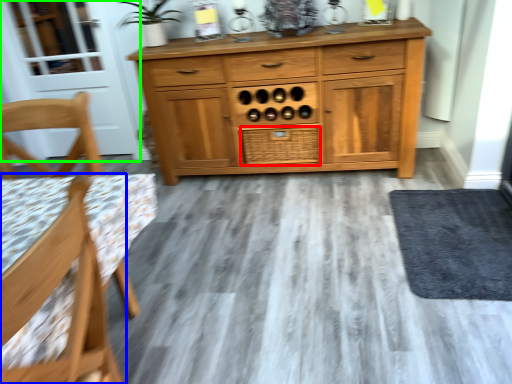
Question: Which object is positioned farthest from drawer (highlighted by a red box)? Select from chair (highlighted by a blue box) and screen door (highlighted by a green box).

Choices:
 (A) chair
 (B) screen door

Answer: (A)